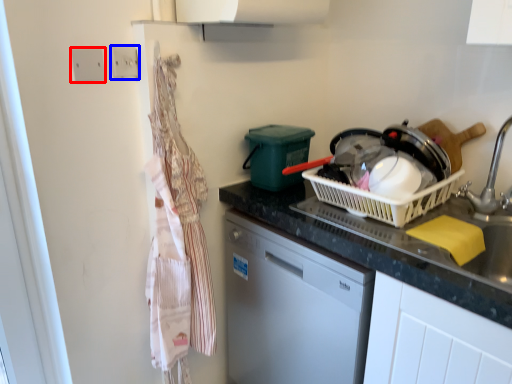
Question: Which object is closer to the camera taking this photo, electric outlet (highlighted by a red box) or electric outlet (highlighted by a blue box)?

Choices:
 (A) electric outlet
 (B) electric outlet

Answer: (A)